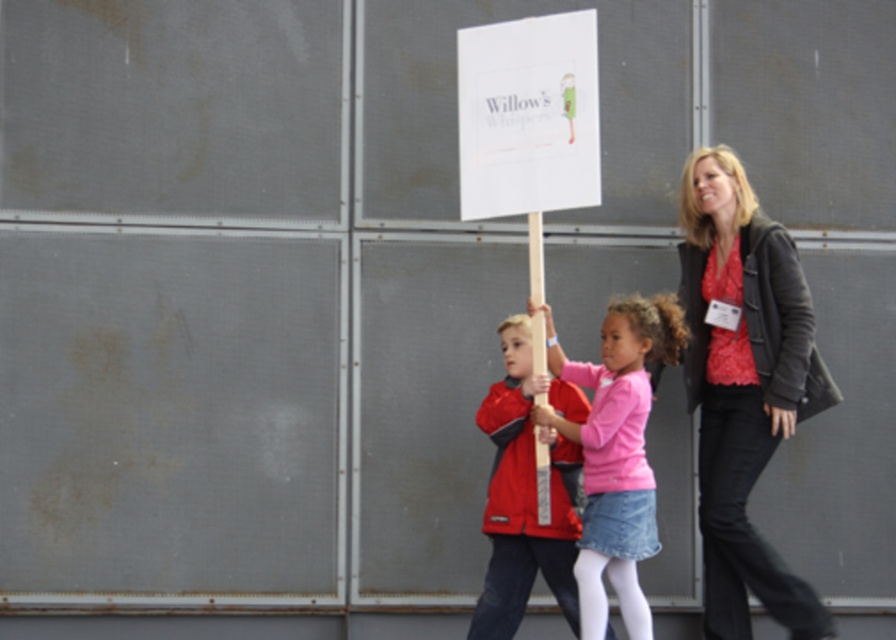
You are a photographer standing behind the industrial wall. You want to take a photo of the matte black jacket at right and the pink matte shirt at center so that they are both in focus. The camera you are using has a depth of field that can cover 16 inches. Will both subjects be in focus?

The matte black jacket at right and pink matte shirt at center are 16.66 inches apart from each other. Since the camera can only cover 16 inches, the distance between them exceeds the depth of field capacity. Therefore, both subjects may not be in focus simultaneously.

You are a photographer trying to capture a photo of the two children in the scene. Since you want to focus on the child in the matte red jacket at center, should you move forward or backward to ensure the pink matte shirt at center doesn t block the view?

You should move forward to ensure the pink matte shirt at center doesn t block the view of the matte red jacket at center, as the pink matte shirt at center is currently positioned behind the matte red jacket at center.